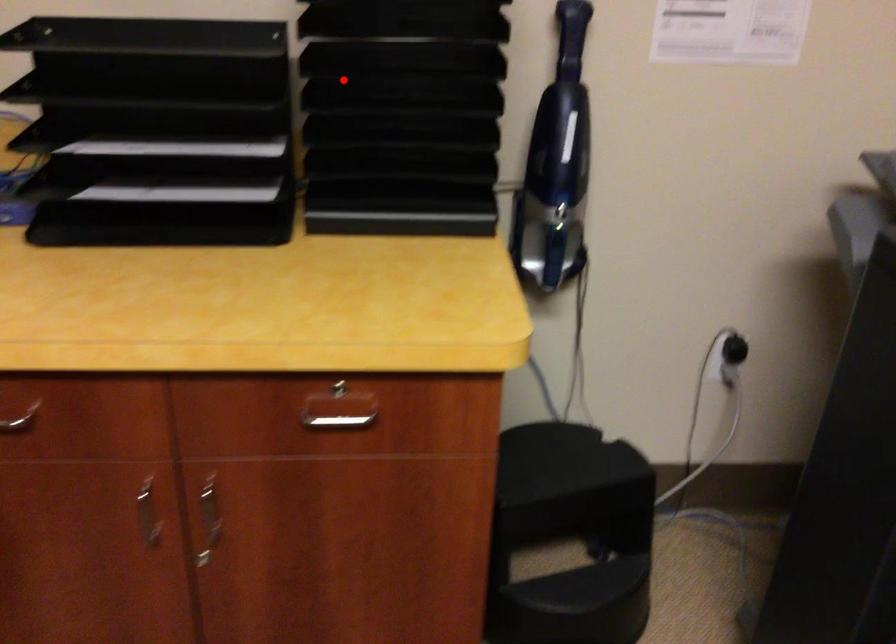
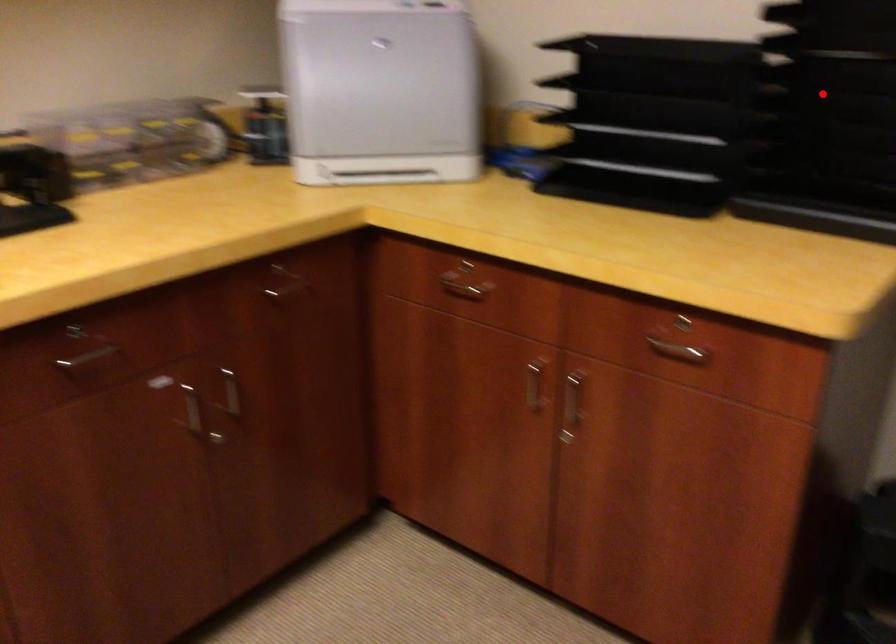
I am providing you with two images of the same scene from different viewpoints. A red point is marked on the first image and another point is marked on the second image. Does the point marked in image1 correspond to the same location as the one in image2?

Yes